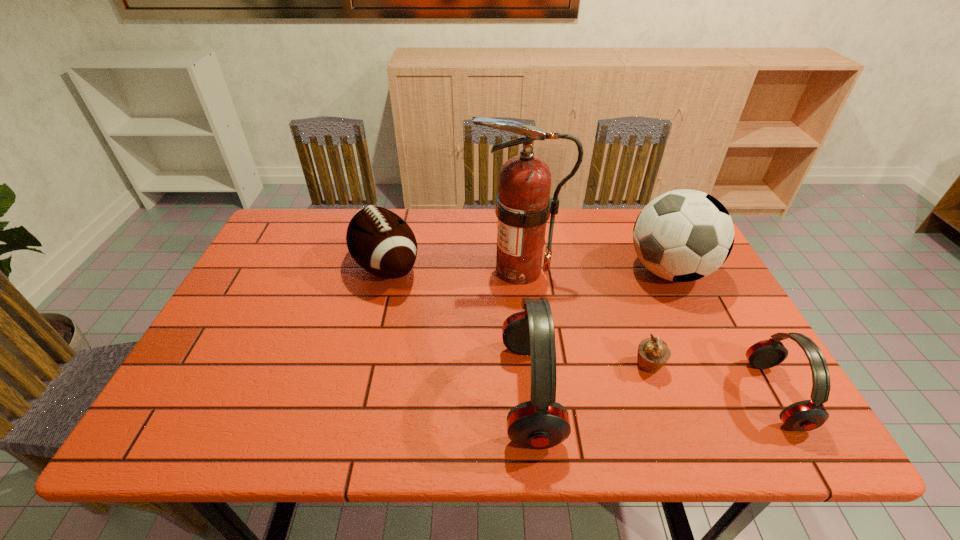
The width and height of the screenshot is (960, 540). Identify the location of soccer ball situated at the far edge. (683, 235).

Find the location of a particular element. football (American) at the far edge is located at coordinates (381, 242).

At what (x,y) coordinates should I click in order to perform the action: click on muffin situated at the near edge. Please return your answer as a coordinate pair (x, y). This screenshot has width=960, height=540. Looking at the image, I should click on (653, 353).

You are a GUI agent. You are given a task and a screenshot of the screen. Output one action in this format:
    pyautogui.click(x=<x>, y=<y>)
    Task: Click on the earphone at the right edge
    The height and width of the screenshot is (540, 960).
    Given the screenshot: What is the action you would take?
    pyautogui.click(x=807, y=415)

This screenshot has height=540, width=960. What are the coordinates of `soccer ball situated at the right edge` in the screenshot? It's located at (683, 235).

Where is `object located at the far right corner`? Image resolution: width=960 pixels, height=540 pixels. object located at the far right corner is located at coordinates (683, 235).

This screenshot has height=540, width=960. Find the location of `object situated at the near right corner`. object situated at the near right corner is located at coordinates (807, 415).

Where is `free space at the far edge`? free space at the far edge is located at coordinates (626, 211).

In the image, there is a desktop. At what (x,y) coordinates should I click in order to perform the action: click on vacant space at the near edge. Please return your answer as a coordinate pair (x, y). This screenshot has width=960, height=540. Looking at the image, I should click on (436, 376).

Where is `blank space at the left edge`? The image size is (960, 540). blank space at the left edge is located at coordinates (245, 306).